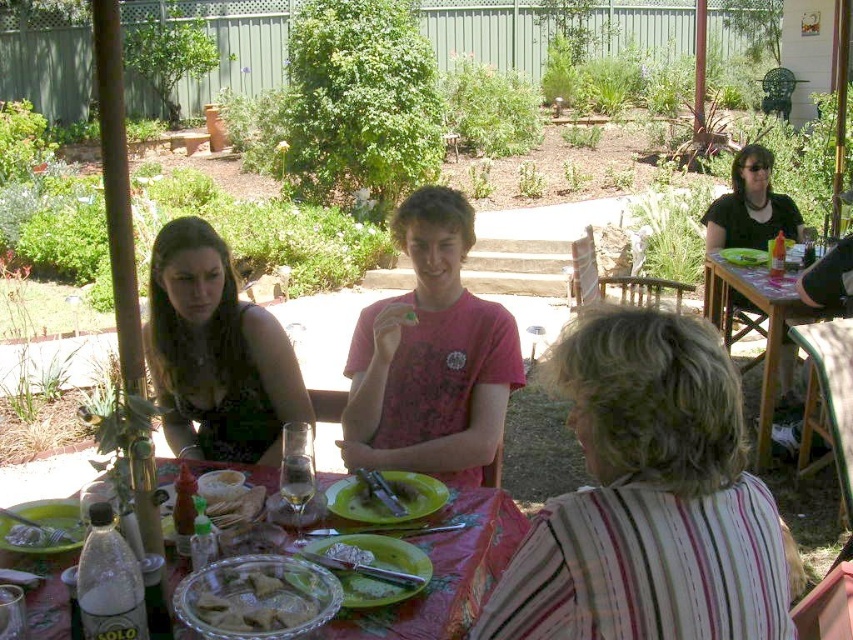
You are a guest at the garden gathering and want to place your phone on the table. The phone is 10 cm tall. Can the translucent glass plate at lower center support it without it touching the matte black shirt at upper right?

The translucent glass plate at lower center is shorter than the matte black shirt at upper right. Since the phone is 10 cm tall, placing it on the plate may cause it to extend beyond the plate and potentially touch the shirt if they are close. However, without knowing the exact distance between them, it is uncertain. But based on height alone, the plate is shorter, so the phone might not be fully supported vertically.

You are a photographer positioned at the edge of the garden pathway. You want to take a photo that includes both the white striped shirt at lower right and the white creamy cheese at center. Which object should you adjust your camera focus on first to ensure both are in the frame?

The white striped shirt at lower right is closer to the viewer than the white creamy cheese at center, so you should focus on the white striped shirt at lower right first to ensure both are in the frame.

You are a photographer setting up for an outdoor event. You need to ensure that the white striped shirt at lower right and the white creamy cheese at center are both visible in your photo. Based on their heights, which object will appear taller in the final image?

The white striped shirt at lower right will appear taller in the final image because it has a greater height compared to the white creamy cheese at center.